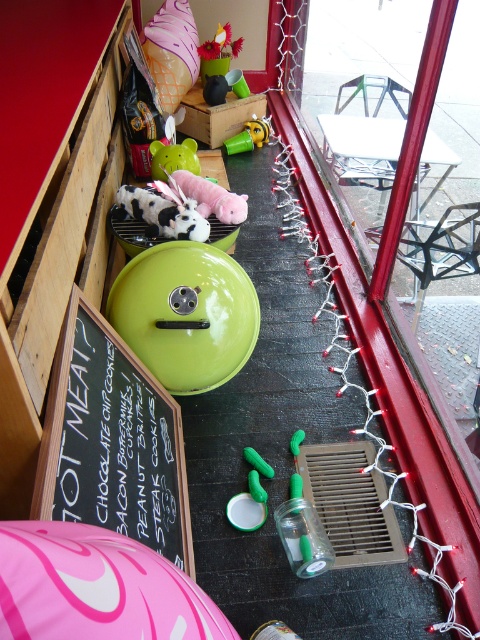
Question: Does black chalkboard at center left appear under green glossy lid at center?

Choices:
 (A) yes
 (B) no

Answer: (A)

Question: Based on their relative distances, which object is farther from the green rubber toy at center?

Choices:
 (A) black chalkboard at center left
 (B) white plush rabbit at center

Answer: (B)

Question: Is green glossy lid at center smaller than pink plush rabbit at center?

Choices:
 (A) no
 (B) yes

Answer: (A)

Question: Estimate the real-world distances between objects in this image. Which object is farther from the green rubber piggy bank at center?

Choices:
 (A) green rubber toy at center
 (B) green glossy lid at center
 (C) clear glass jar at lower left
 (D) black chalkboard at center left

Answer: (A)

Question: Which of the following is the farthest from the observer?

Choices:
 (A) clear glass jar at lower left
 (B) green rubber toy at center

Answer: (B)

Question: Is black chalkboard at center left to the right of clear glass jar at lower left from the viewer's perspective?

Choices:
 (A) no
 (B) yes

Answer: (A)